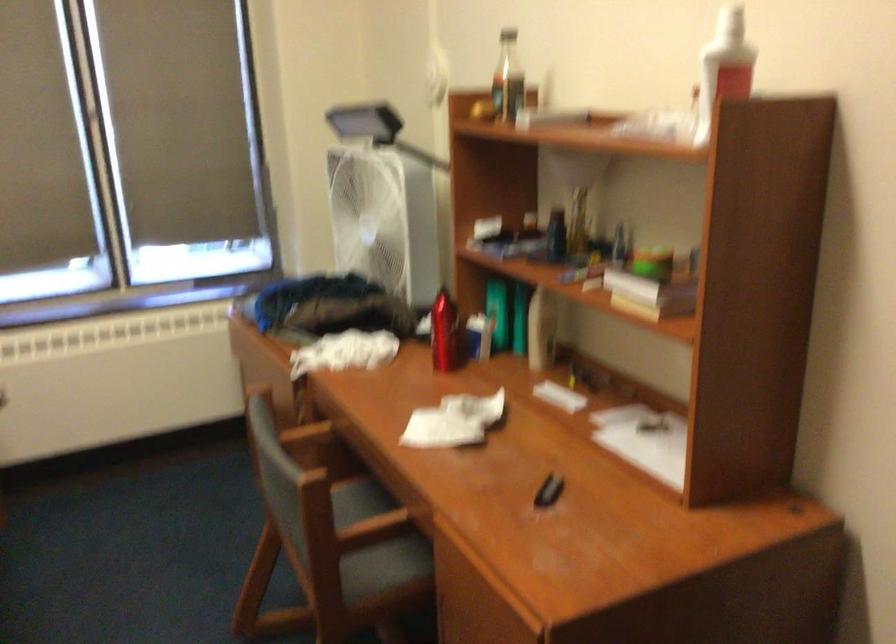
The image size is (896, 644). What are the coordinates of `chair sitting surface` in the screenshot? It's located at (375, 545).